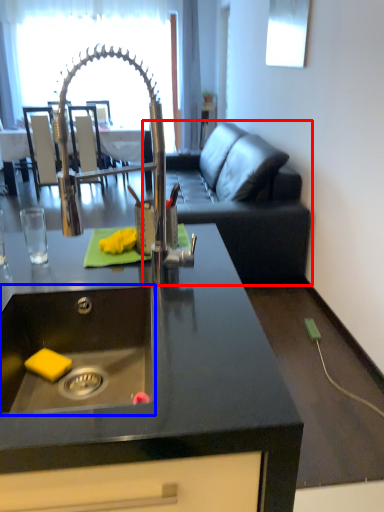
Question: Which object appears closest to the camera in this image, studio couch (highlighted by a red box) or sink (highlighted by a blue box)?

Choices:
 (A) studio couch
 (B) sink

Answer: (B)